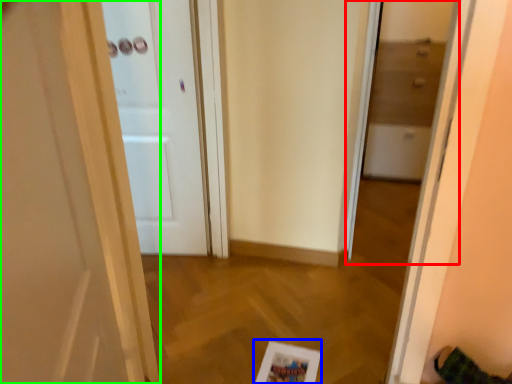
Question: Estimate the real-world distances between objects in this image. Which object is closer to glass door (highlighted by a red box), picture frame (highlighted by a blue box) or door (highlighted by a green box)?

Choices:
 (A) picture frame
 (B) door

Answer: (A)